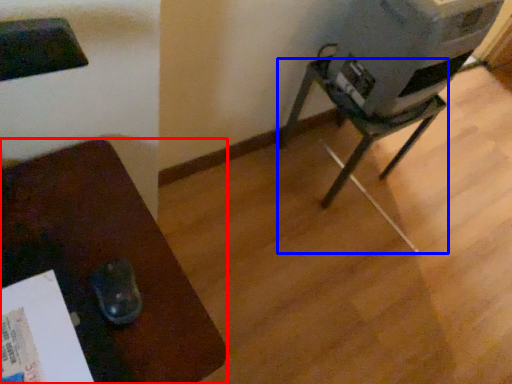
Question: Which of the following is the closest to the observer, furniture (highlighted by a red box) or furniture (highlighted by a blue box)?

Choices:
 (A) furniture
 (B) furniture

Answer: (A)